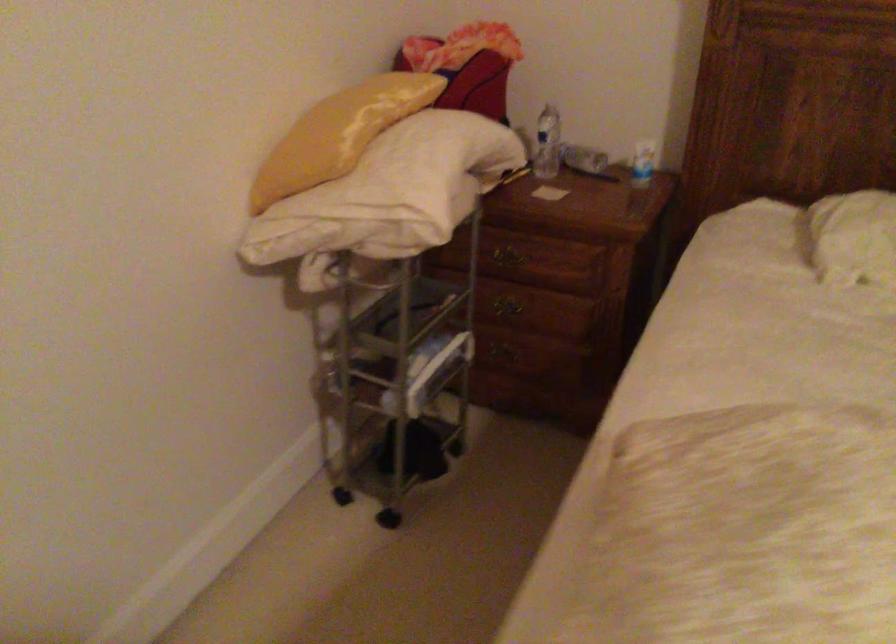
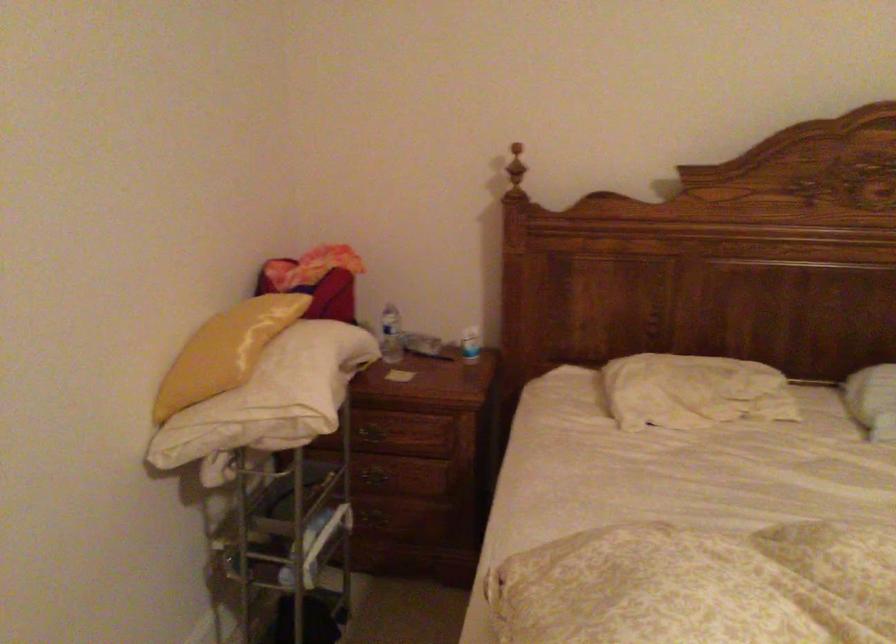
Locate, in the second image, the point that corresponds to point (510, 351) in the first image.

(381, 516)